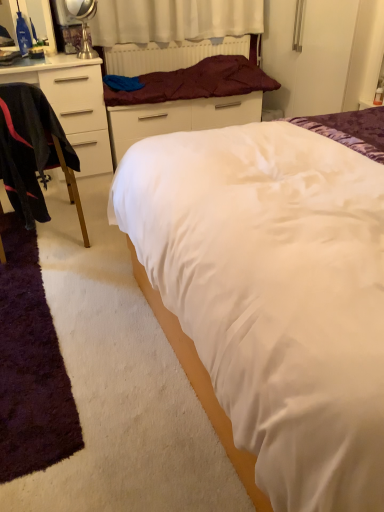
Question: Considering the relative positions of white satin bed at center and purple shaggy rug at lower left in the image provided, is white satin bed at center to the left of purple shaggy rug at lower left from the viewer's perspective?

Choices:
 (A) no
 (B) yes

Answer: (A)

Question: From a real-world perspective, is white satin bed at center under purple shaggy rug at lower left?

Choices:
 (A) yes
 (B) no

Answer: (B)

Question: Can you confirm if white satin bed at center is taller than purple shaggy rug at lower left?

Choices:
 (A) no
 (B) yes

Answer: (B)

Question: Would you say white satin bed at center is outside purple shaggy rug at lower left?

Choices:
 (A) yes
 (B) no

Answer: (A)

Question: Is white satin bed at center positioned before purple shaggy rug at lower left?

Choices:
 (A) no
 (B) yes

Answer: (B)

Question: Considering the relative sizes of white satin bed at center and purple shaggy rug at lower left in the image provided, is white satin bed at center bigger than purple shaggy rug at lower left?

Choices:
 (A) yes
 (B) no

Answer: (A)

Question: Is white matte cabinet at left directly adjacent to purple shaggy rug at lower left?

Choices:
 (A) yes
 (B) no

Answer: (B)

Question: Could you tell me if white matte cabinet at left is turned towards purple shaggy rug at lower left?

Choices:
 (A) no
 (B) yes

Answer: (B)

Question: Can you confirm if white matte cabinet at left is positioned to the right of purple shaggy rug at lower left?

Choices:
 (A) yes
 (B) no

Answer: (B)

Question: From a real-world perspective, is white matte cabinet at left on top of purple shaggy rug at lower left?

Choices:
 (A) yes
 (B) no

Answer: (A)

Question: Does white matte cabinet at left have a lesser height compared to purple shaggy rug at lower left?

Choices:
 (A) no
 (B) yes

Answer: (A)

Question: Considering the relative positions of white matte cabinet at left and purple shaggy rug at lower left in the image provided, is white matte cabinet at left to the left of purple shaggy rug at lower left from the viewer's perspective?

Choices:
 (A) no
 (B) yes

Answer: (B)

Question: Is white glossy bed frame at upper center taller than maroon fabric radiator at upper center?

Choices:
 (A) yes
 (B) no

Answer: (A)